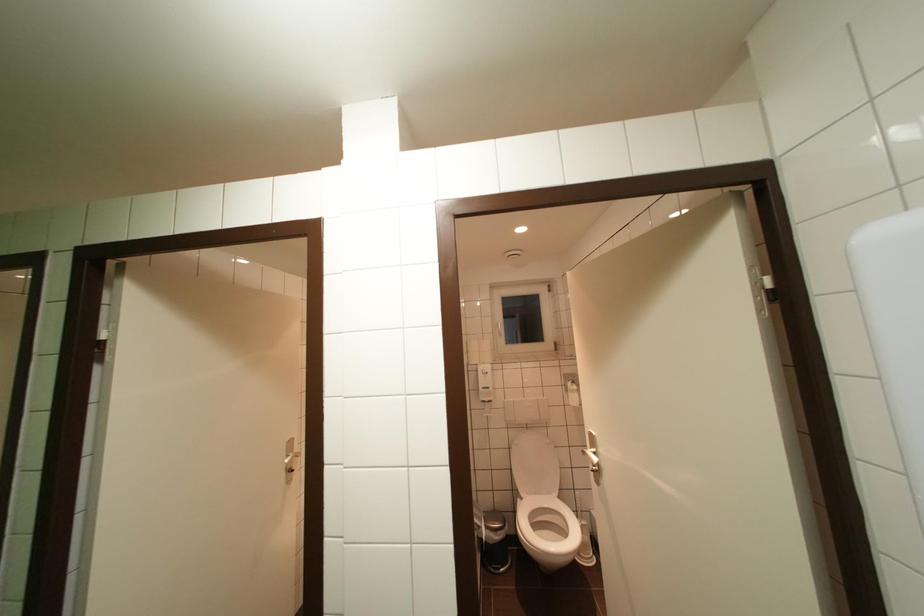
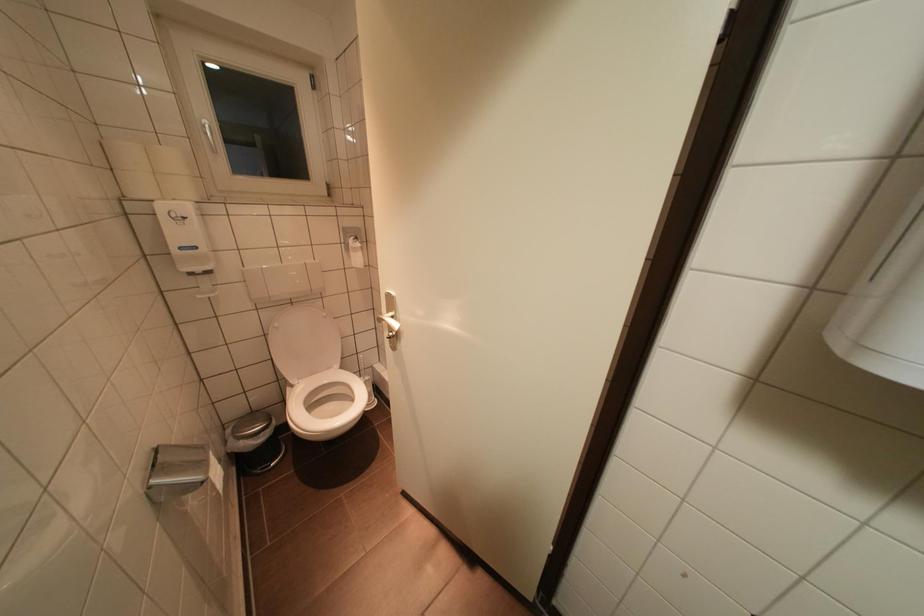
The images are taken continuously from a first-person perspective. In which direction is your viewpoint rotating?

The rotation direction of the camera is right-down.